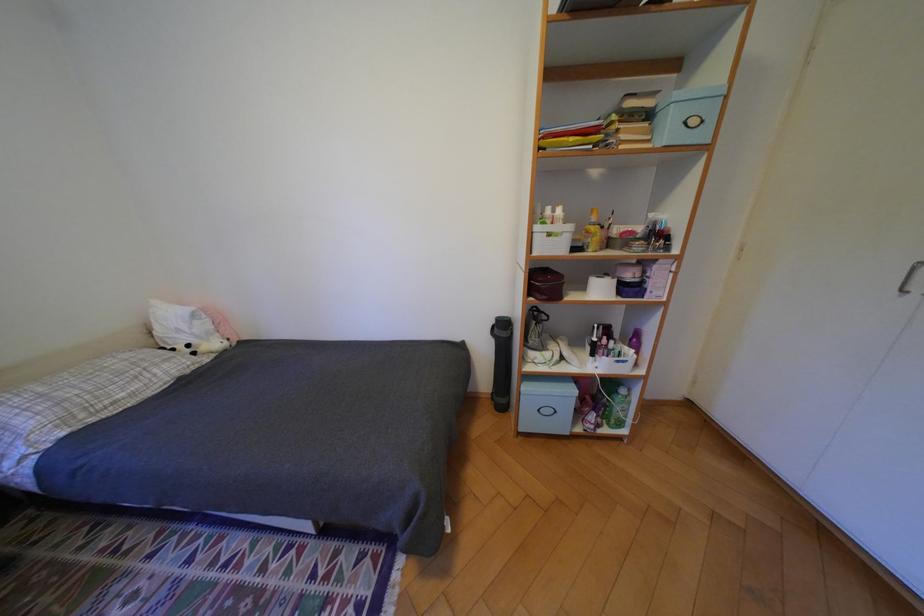
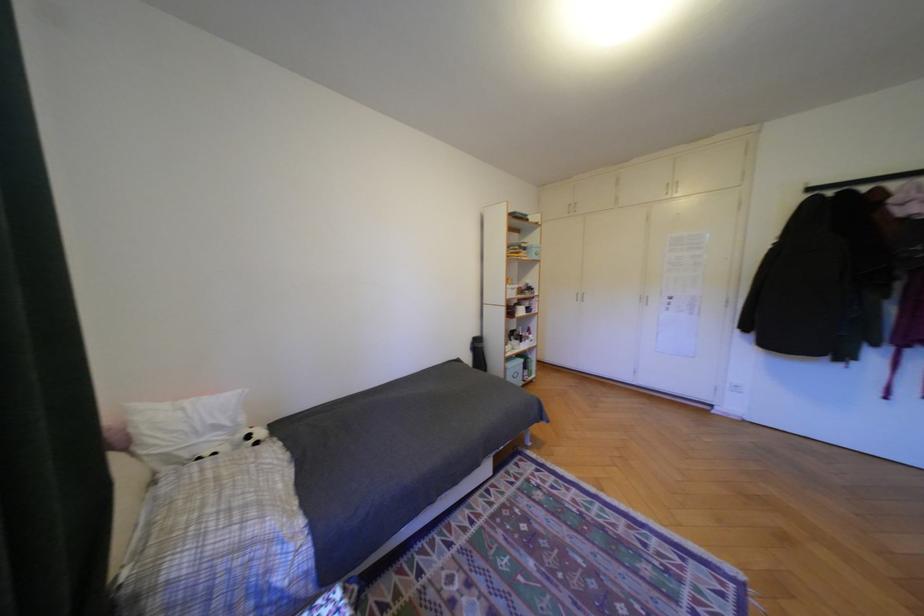
Locate, in the second image, the point that corresponds to point 191,331 in the first image.

(228, 427)